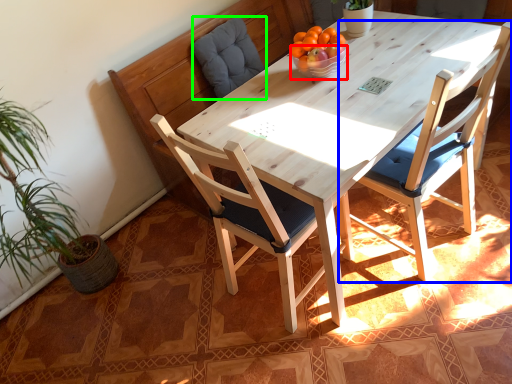
Question: Which is farther away from bowl (highlighted by a red box)? chair (highlighted by a blue box) or swivel chair (highlighted by a green box)?

Choices:
 (A) chair
 (B) swivel chair

Answer: (B)